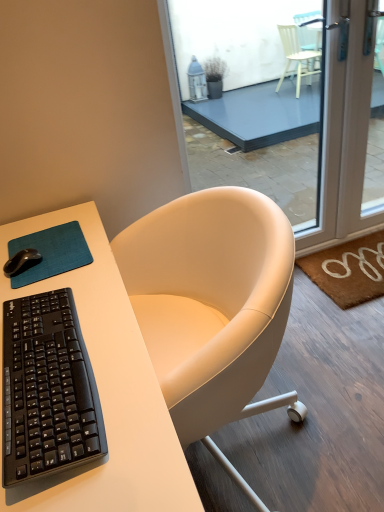
Locate an element on the screen. The width and height of the screenshot is (384, 512). empty space that is ontop of brown coir doormat at lower right (from a real-world perspective) is located at coordinates (359, 257).